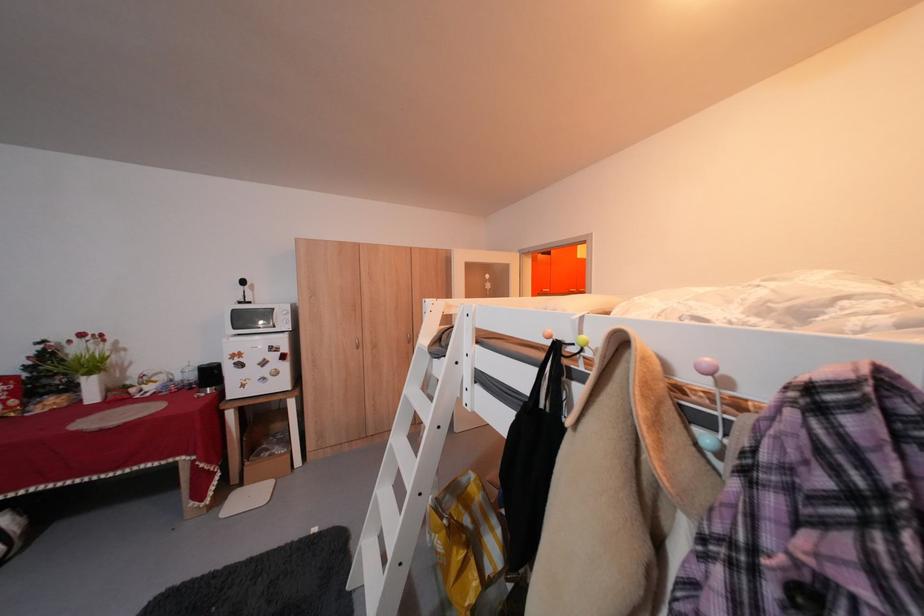
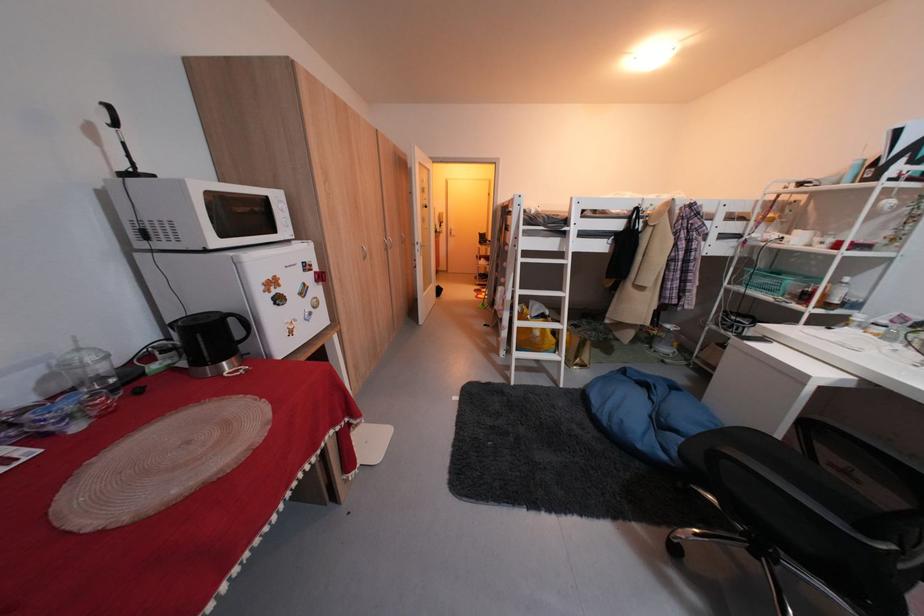
In the second image, find the point that corresponds to (201,368) in the first image.

(91, 351)